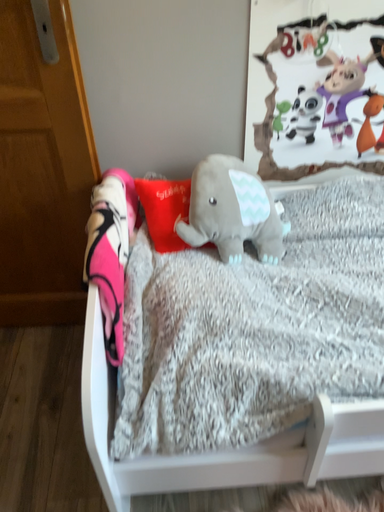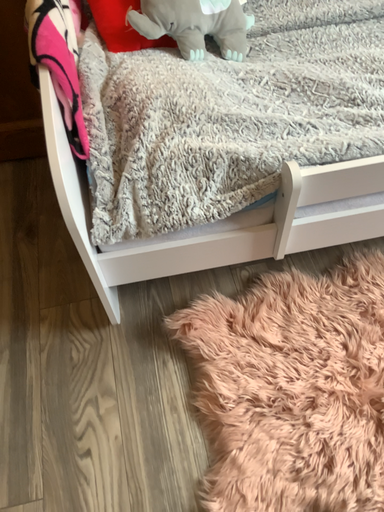
Question: How did the camera likely rotate when shooting the video?

Choices:
 (A) rotated downward
 (B) rotated upward

Answer: (A)